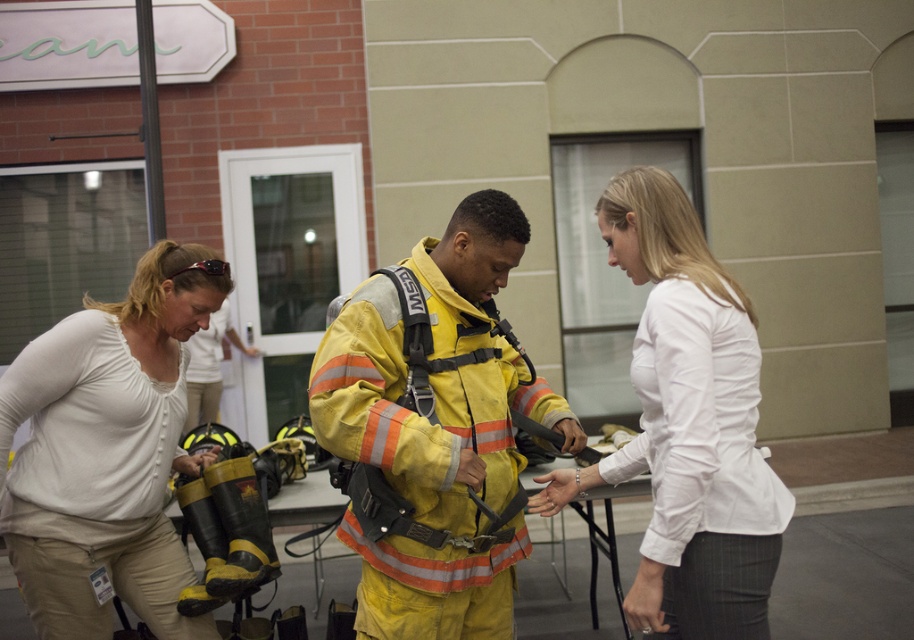
Question: Is yellow reflective uniform at center further to camera compared to white smooth shirt at center?

Choices:
 (A) yes
 (B) no

Answer: (A)

Question: Which point is farther to the camera?

Choices:
 (A) white smooth shirt at center
 (B) light beige pants at lower left
 (C) yellow reflective uniform at center
 (D) yellow reflective jacket at center

Answer: (D)

Question: Can you confirm if white smooth shirt at center is positioned to the left of yellow reflective jacket at center?

Choices:
 (A) yes
 (B) no

Answer: (B)

Question: Which point is farther from the camera taking this photo?

Choices:
 (A) [498, 586]
 (B) [86, 307]

Answer: (B)

Question: Which point is farther to the camera?

Choices:
 (A) light beige pants at lower left
 (B) yellow reflective jacket at center
 (C) white smooth shirt at center
 (D) yellow reflective uniform at center

Answer: (B)

Question: Is light beige pants at lower left to the right of white smooth shirt at center from the viewer's perspective?

Choices:
 (A) no
 (B) yes

Answer: (A)